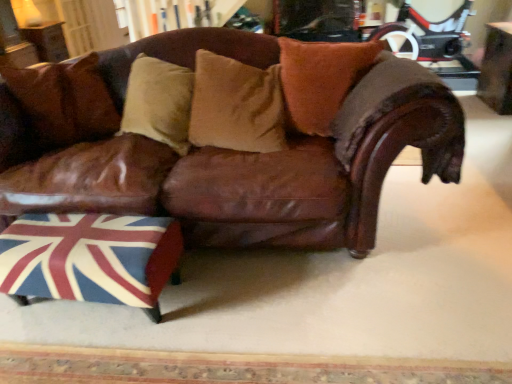
Where is `free space between brown leather couch at center and union jack fabric ottoman at lower left`? Image resolution: width=512 pixels, height=384 pixels. free space between brown leather couch at center and union jack fabric ottoman at lower left is located at coordinates (257, 302).